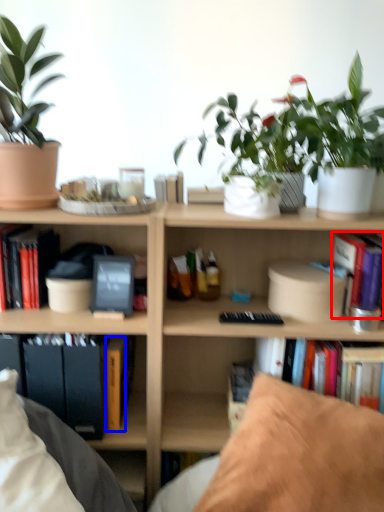
Question: Which point is further to the camera, book (highlighted by a red box) or paperback book (highlighted by a blue box)?

Choices:
 (A) book
 (B) paperback book

Answer: (B)